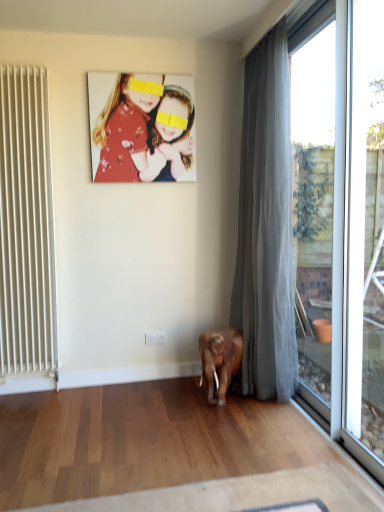
Question: Is floral fabric photo at upper center spatially inside white plastic window frame at right, which appears as the 2th window frame when viewed from the back, or outside of it?

Choices:
 (A) inside
 (B) outside

Answer: (B)

Question: Is point (99, 104) closer or farther from the camera than point (375, 465)?

Choices:
 (A) closer
 (B) farther

Answer: (B)

Question: Which object is positioned closest to the white plastic window frame at right, which appears as the 2th window frame when viewed from the back?

Choices:
 (A) white plastic power outlet at lower center
 (B) transparent glass window at right, acting as the 1th window frame starting from the back
 (C) white matte radiator at left
 (D) gray sheer curtain at right
 (E) floral fabric photo at upper center

Answer: (D)

Question: Based on their relative distances, which object is farther from the white plastic power outlet at lower center?

Choices:
 (A) floral fabric photo at upper center
 (B) gray sheer curtain at right
 (C) transparent glass window at right, which is the second window frame in front-to-back order
 (D) white plastic window frame at right, which appears as the 2th window frame when viewed from the back
 (E) white matte radiator at left

Answer: (C)